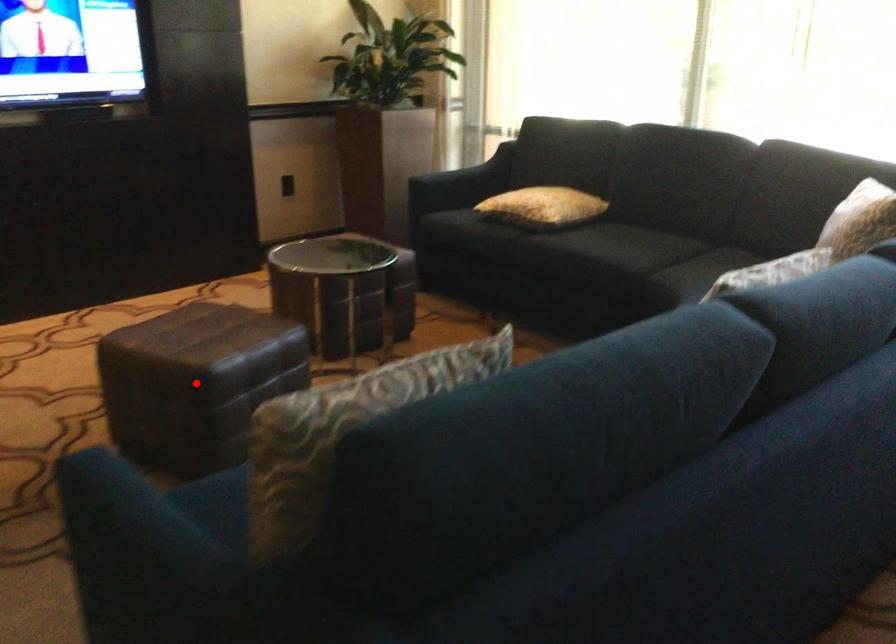
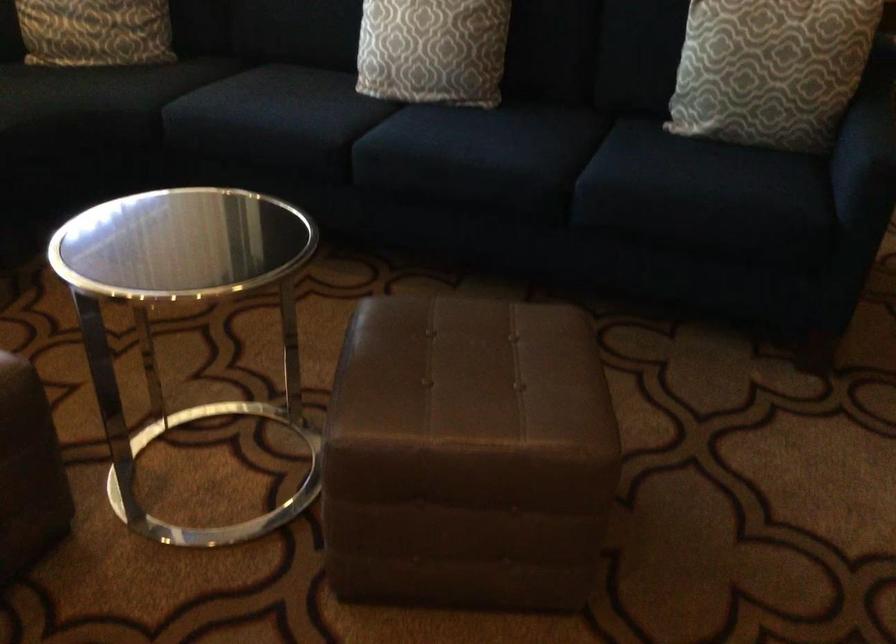
Where in the second image is the point corresponding to the highlighted location from the first image?

(604, 324)